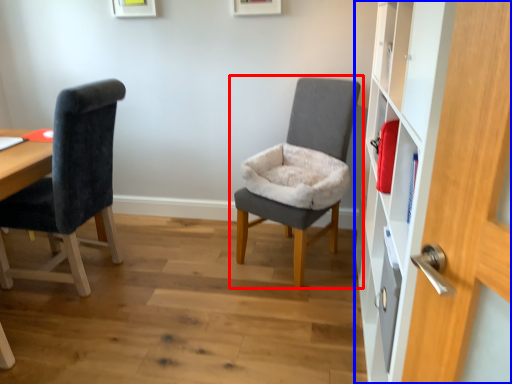
Question: Which point is closer to the camera, chair (highlighted by a red box) or dresser (highlighted by a blue box)?

Choices:
 (A) chair
 (B) dresser

Answer: (B)